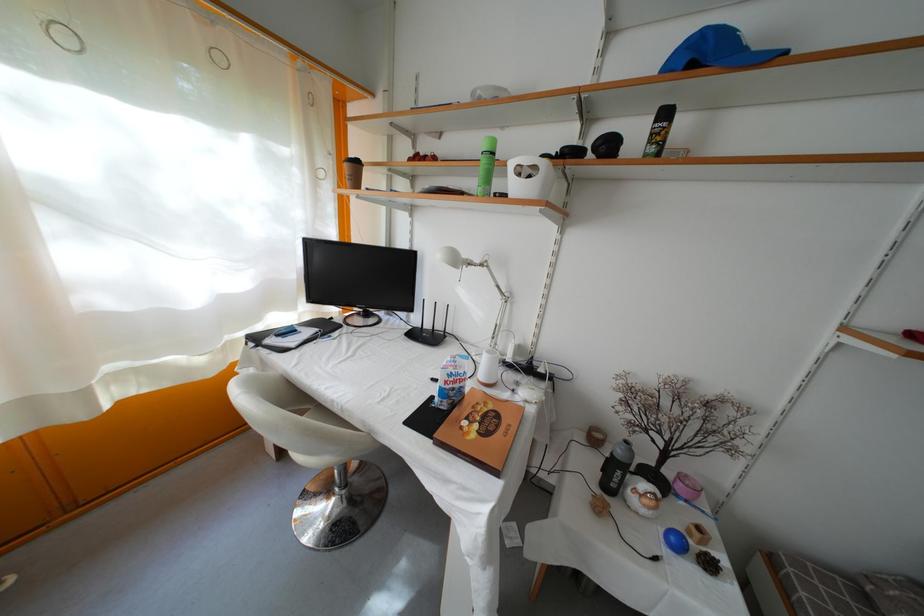
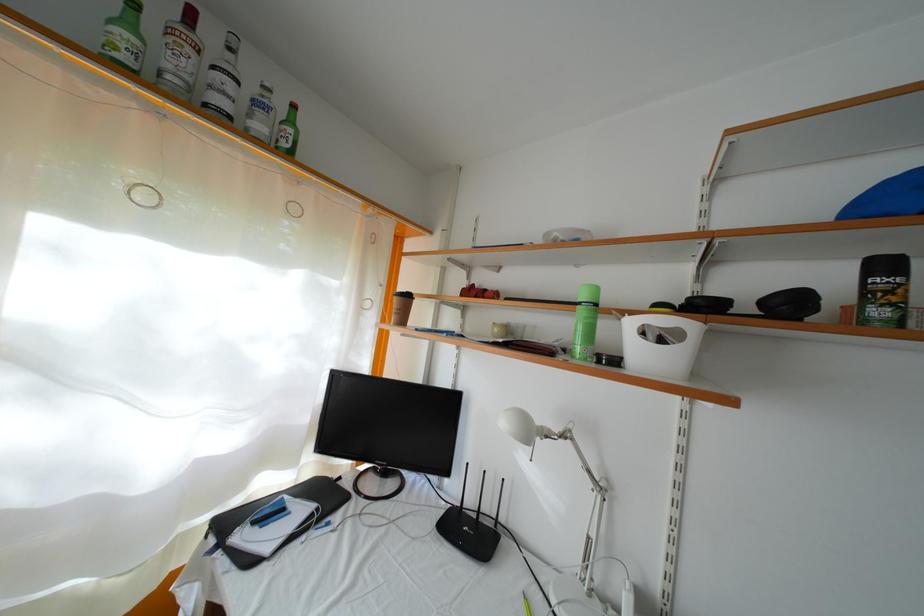
The point at (462, 265) is marked in the first image. Where is the corresponding point in the second image?

(535, 439)